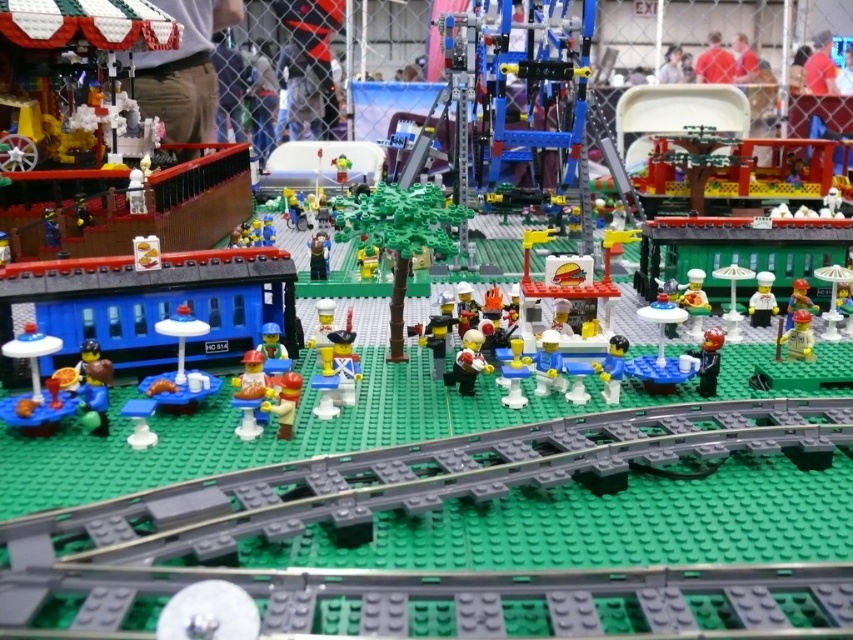
You are a LEGO enthusiast observing the train station area. You notice two figures there. Which of the two figures, the smooth blue figure at center or the yellow plastic minifigure at center, would be easier to fit into a narrow space between LEGO bricks?

The smooth blue figure at center is thinner than the yellow plastic minifigure at center, so it would be easier to fit into a narrow space between LEGO bricks.

You are a LEGO figure standing at the train station. You want to place a white glossy chef hat at center and a yellow matte cupcake at center on the platform so that they are exactly 18 inches apart. Can you do that based on the current setup?

The white glossy chef hat at center and yellow matte cupcake at center are currently 17.04 inches apart. Since 17.04 inches is less than 18 inches, you can move them slightly apart to achieve the desired distance.

You are a visitor at the LEGO diorama exhibition. You want to locate the smooth blue figure at center. Where is it positioned in the image?

The smooth blue figure at center is positioned at point coordinates of (x=612, y=369).